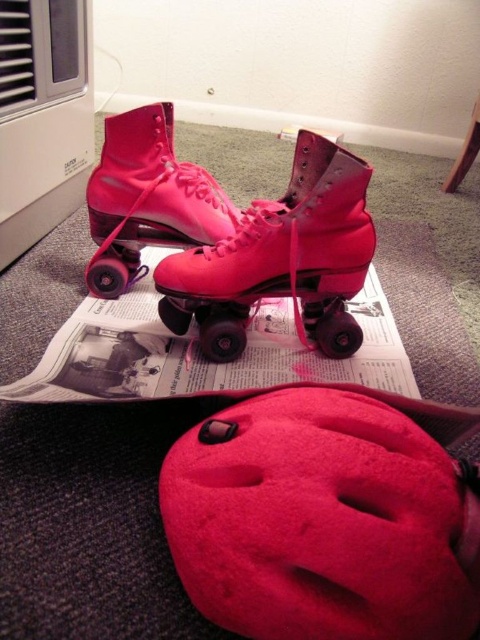
You are organizing items on a desk and need to place the printed paper magazine at center and the pink matte roller skate at center. According to their positions, which item is located to the left?

The pink matte roller skate at center is located to the left of the printed paper magazine at center because the printed paper magazine at center is to the right of it.

You are organizing a roller skating event and need to place the matte pink roller skate at center and the printed paper magazine at center on a table. Which object should you place first to ensure the magazine is visible?

The printed paper magazine at center should be placed first because the matte pink roller skate at center is positioned over it, so placing the magazine first will allow it to remain visible underneath the skate.

You are organizing a small display for a skate shop and need to arrange the printed paper magazine at center and the pink matte roller skate at center. If you want to place the taller item on a higher shelf to make it more visible, which object should go on the higher shelf?

The pink matte roller skate at center is taller than the printed paper magazine at center, so it should be placed on the higher shelf to make it more visible.